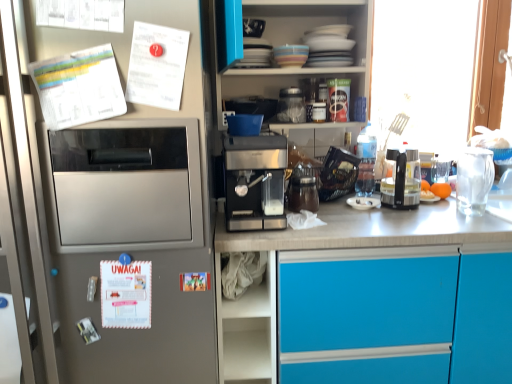
Locate an element on the screen. The width and height of the screenshot is (512, 384). free space in front of orange matte fruit at right is located at coordinates (446, 209).